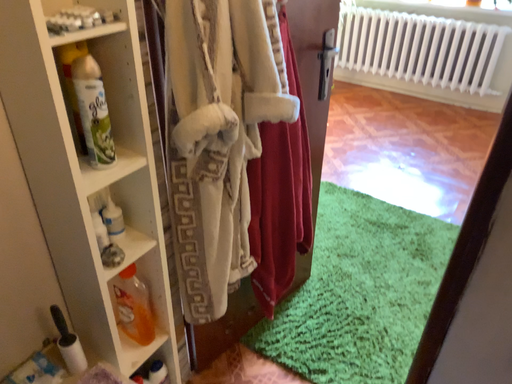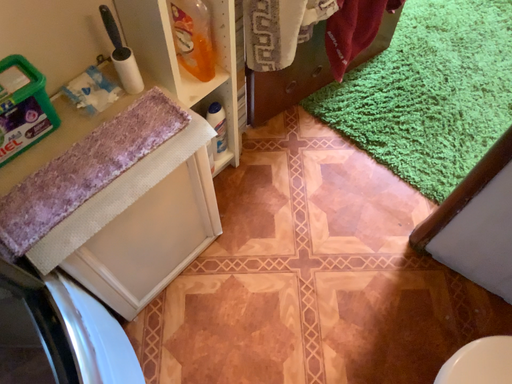
Question: Which way did the camera rotate in the video?

Choices:
 (A) rotated right
 (B) rotated left

Answer: (B)